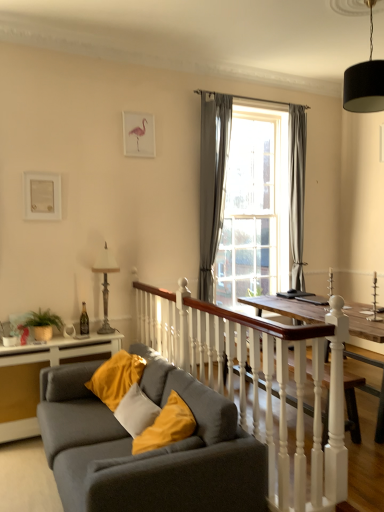
Question: From a real-world perspective, is metallic silver lamp at left physically located above or below pink paper picture frame at upper center, arranged as the 2th picture frame when viewed from the left?

Choices:
 (A) above
 (B) below

Answer: (B)

Question: From the image's perspective, relative to pink paper picture frame at upper center, marked as the 1th picture frame in a top-to-bottom arrangement, is metallic silver lamp at left above or below?

Choices:
 (A) above
 (B) below

Answer: (B)

Question: Considering the real-world distances, which object is farthest from the gray fabric curtain at center, arranged as the second curtain when viewed from the right?

Choices:
 (A) metallic silver lamp at left
 (B) wooden table at lower left
 (C) white wooden balustrade at center
 (D) light gray fabric curtain at center, which ranks as the 2th curtain in left-to-right order
 (E) white matte picture frame at upper left, positioned as the first picture frame in left-to-right order

Answer: (B)

Question: Which object is positioned farthest from the pink paper picture frame at upper center, marked as the 1th picture frame in a top-to-bottom arrangement?

Choices:
 (A) gray fabric curtain at center, arranged as the second curtain when viewed from the right
 (B) light gray fabric curtain at center, which ranks as the 2th curtain in left-to-right order
 (C) white wooden balustrade at center
 (D) white matte picture frame at upper left, which is the 2th picture frame in right-to-left order
 (E) matte gray couch at lower left

Answer: (E)